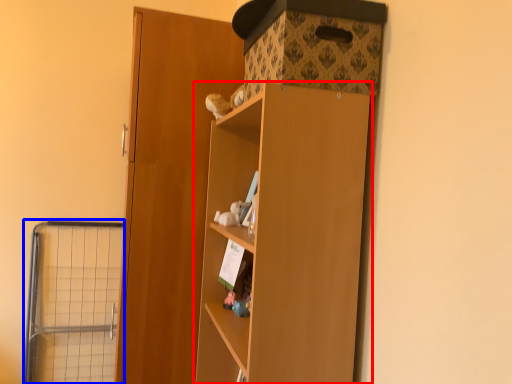
Question: Which object is further to the camera taking this photo, cupboard (highlighted by a red box) or cage (highlighted by a blue box)?

Choices:
 (A) cupboard
 (B) cage

Answer: (B)